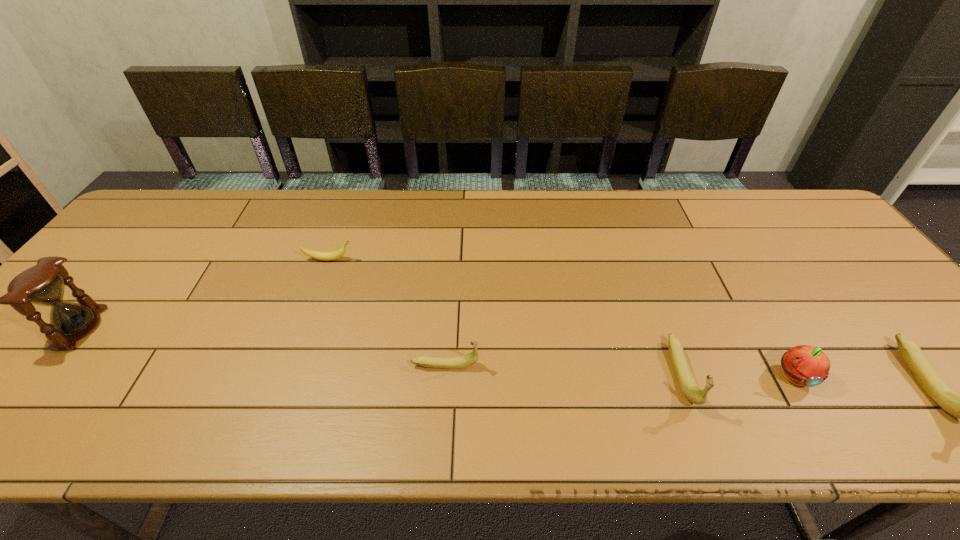
You are a GUI agent. You are given a task and a screenshot of the screen. Output one action in this format:
    pyautogui.click(x=<x>, y=<y>)
    Task: Click on the third object from left to right
    
    Given the screenshot: What is the action you would take?
    pyautogui.click(x=467, y=360)

Image resolution: width=960 pixels, height=540 pixels. I want to click on the second banana from left to right, so click(467, 360).

In order to click on the third tallest object in this screenshot , I will do tap(689, 387).

Find the location of a particular element. The image size is (960, 540). the third shortest banana is located at coordinates (689, 387).

Find the location of a particular element. The height and width of the screenshot is (540, 960). the farthest object is located at coordinates (333, 255).

At what (x,y) coordinates should I click in order to perform the action: click on the shortest banana. Please return your answer as a coordinate pair (x, y). This screenshot has width=960, height=540. Looking at the image, I should click on (333, 255).

Where is `apple`? This screenshot has width=960, height=540. apple is located at coordinates (803, 365).

The image size is (960, 540). Identify the location of hourglass. (43, 284).

Where is `the leftmost object`? the leftmost object is located at coordinates (43, 284).

I want to click on free space located at the stem of the fourth object from right to left, so click(523, 365).